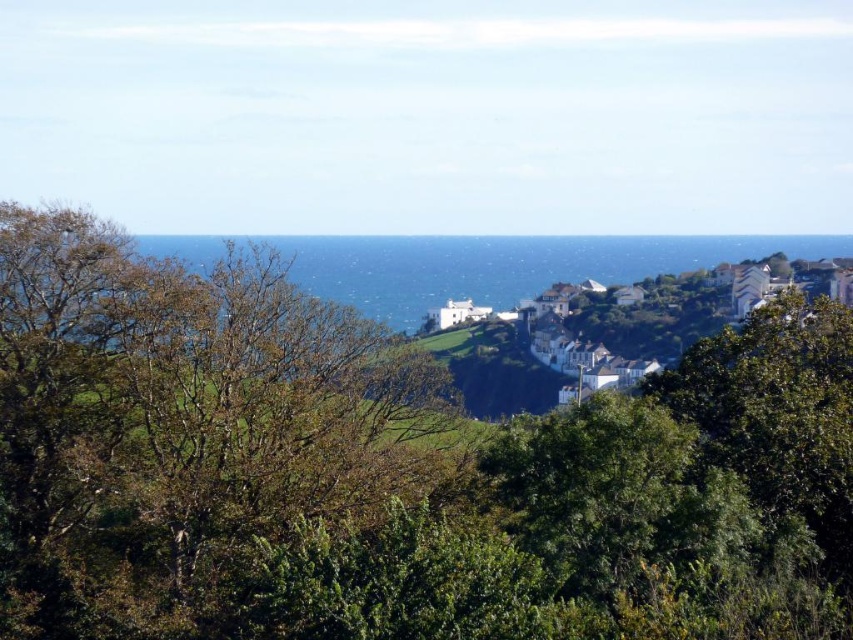
You are standing on a cliff overlooking the coastal view. You see the blue water at center and the white painted houses at center. If you want to look towards the ocean first before focusing on the houses, which direction should you shift your gaze?

You should shift your gaze to the left because the blue water at center is to the left of the white painted houses at center.

You are standing at the point labeled as point (x=181, y=428) in the image. What object is directly in front of you?

The point (x=181, y=428) indicates a brown leafy tree at center, so the object directly in front of you is the brown leafy tree at center.

You are a tourist standing in the coastal area and want to take a photo of the white painted houses at center while including the brown leafy tree at center in the frame. Based on their positions, which side of the houses should you position the tree on in your photo?

The brown leafy tree at center is to the left of the white painted houses at center, so you should position the tree on the left side of the houses in your photo.